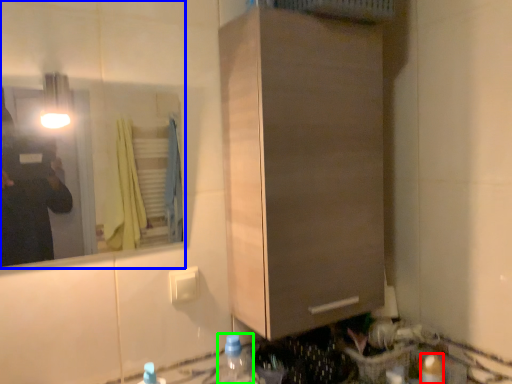
Question: Which object is the farthest from bottle (highlighted by a red box)? Choose among these: mirror (highlighted by a blue box) or bottle (highlighted by a green box).

Choices:
 (A) mirror
 (B) bottle

Answer: (A)